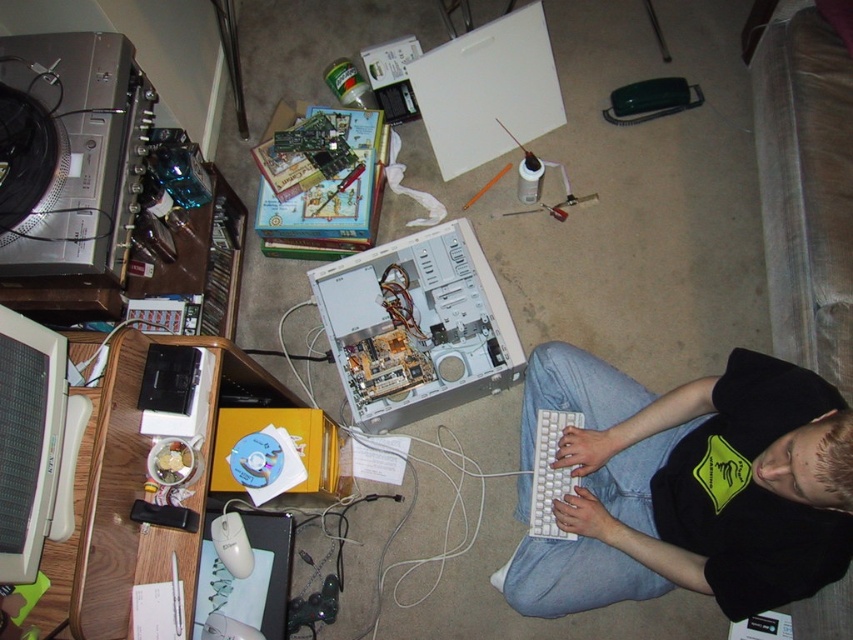
You are setting up a computer workstation and need to place the white plastic computer case at center and the white plastic keyboard at lower center. According to the image, where should you position the computer case relative to the keyboard?

The white plastic computer case at center should be positioned above the white plastic keyboard at lower center as per the image.

You are organizing the items on the desk. The white plastic computer case at center and the white plastic keyboard at lower center are both on the desk. Which one is positioned to the left side of the desk?

The white plastic computer case at center is to the left of the white plastic keyboard at lower center, so the computer case is positioned to the left side of the desk.